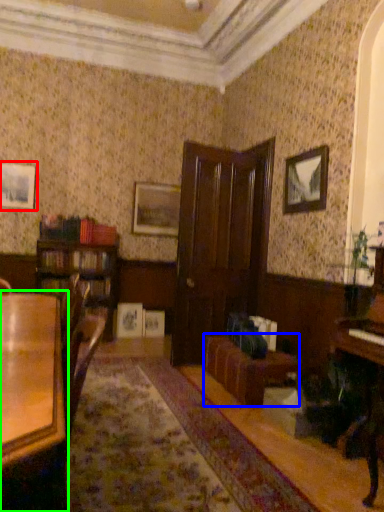
Question: Which object is the closest to the picture frame (highlighted by a red box)? Choose among these: couch (highlighted by a blue box) or table (highlighted by a green box).

Choices:
 (A) couch
 (B) table

Answer: (A)